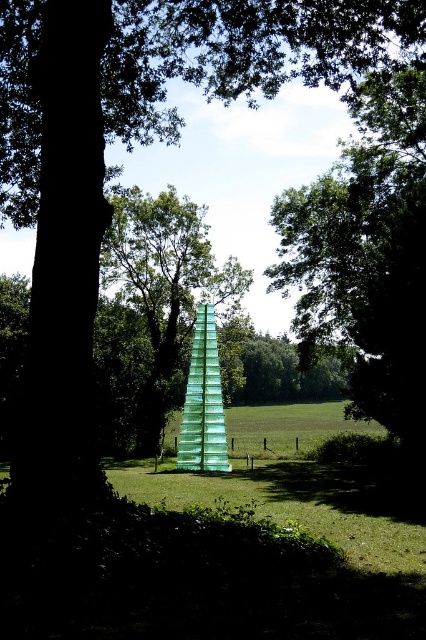
Can you confirm if green leafy tree at center is thinner than green glass tower at center?

No.

Does point (360, 227) lie behind point (209, 428)?

Yes, point (360, 227) is farther from viewer.

Is point (374, 349) closer to viewer compared to point (210, 344)?

Yes, point (374, 349) is closer to viewer.

Identify the location of green leafy tree at center. (367, 257).

Is point (400, 424) less distant than point (238, 285)?

Yes, it is in front of point (238, 285).

Does green leafy tree at center have a smaller size compared to transparent glass tower at center?

No, green leafy tree at center is not smaller than transparent glass tower at center.

Find the location of `green leafy tree at center`. green leafy tree at center is located at coordinates (367, 257).

Where is `green leafy tree at center`? This screenshot has height=640, width=426. green leafy tree at center is located at coordinates (367, 257).

This screenshot has width=426, height=640. What do you see at coordinates (160, 314) in the screenshot?
I see `transparent glass tower at center` at bounding box center [160, 314].

Which is below, transparent glass tower at center or green glass tower at center?

green glass tower at center

Between point (152, 324) and point (198, 340), which one is positioned behind?

Point (152, 324)

Find the location of a particular element. Image resolution: width=426 pixels, height=640 pixels. transparent glass tower at center is located at coordinates (160, 314).